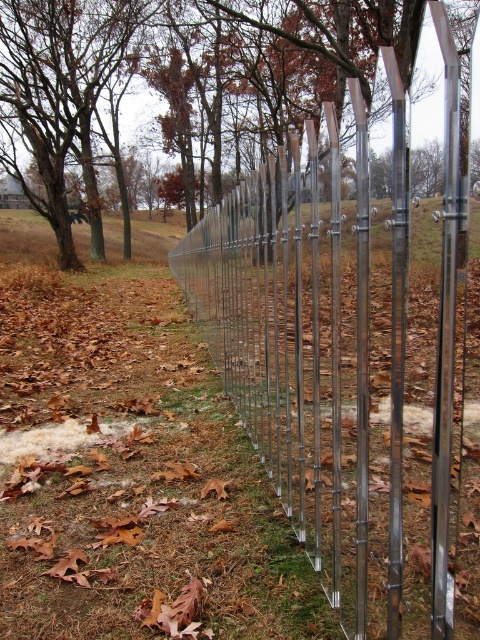
Question: Does metallic silver fence at center have a smaller size compared to brown leafy tree at upper left?

Choices:
 (A) yes
 (B) no

Answer: (A)

Question: Which object is closer to the camera taking this photo?

Choices:
 (A) metallic silver pole at center
 (B) brown leafy tree at upper left

Answer: (B)

Question: Is metallic silver fence at center positioned before metallic silver pole at center?

Choices:
 (A) yes
 (B) no

Answer: (A)

Question: From the image, what is the correct spatial relationship of metallic silver fence at center in relation to brown leafy tree at upper left?

Choices:
 (A) below
 (B) above

Answer: (A)

Question: Among these points, which one is farthest from the camera?

Choices:
 (A) (367, 180)
 (B) (364, 358)

Answer: (B)

Question: Estimate the real-world distances between objects in this image. Which object is closer to the metallic silver fence at center?

Choices:
 (A) brown leafy tree at upper left
 (B) polished metal pole at center

Answer: (B)